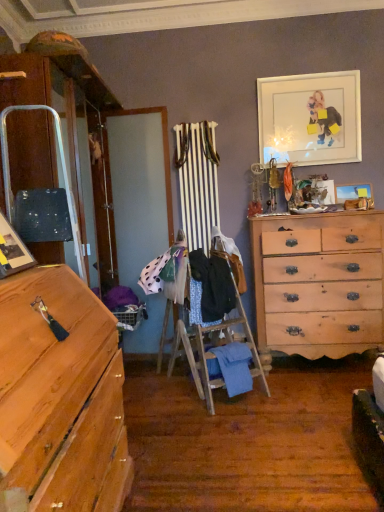
This screenshot has height=512, width=384. I want to click on light brown wooden chest of drawers at right, so click(x=319, y=283).

Measure the distance between point (346, 199) and camera.

Point (346, 199) is 11.96 feet from camera.

What do you see at coordinates (12, 251) in the screenshot? Image resolution: width=384 pixels, height=512 pixels. I see `matte black picture frame at left, marked as the 3th picture frame in a right-to-left arrangement` at bounding box center [12, 251].

From the picture: How much space does white matte picture frame at upper right, arranged as the 2th picture frame when viewed from the back, occupy horizontally?

white matte picture frame at upper right, arranged as the 2th picture frame when viewed from the back, is 3.61 inches in width.

You are a GUI agent. You are given a task and a screenshot of the screen. Output one action in this format:
    pyautogui.click(x=<x>, y=<y>)
    Task: Click on the blue textured fabric at center, which ranks as the 3th clothing in top-to-bottom order
    
    Given the screenshot: What is the action you would take?
    pyautogui.click(x=198, y=305)

Does point (350, 187) come in front of point (233, 384)?

No, (350, 187) is further to viewer.

Between wooden picture frame at upper right, which appears as the third picture frame when viewed from the front, and blue cotton blanket at center, which is the 1th clothing from bottom to top, which one has more height?

blue cotton blanket at center, which is the 1th clothing from bottom to top.

Would you say wooden picture frame at upper right, the second picture frame when ordered from top to bottom, is to the left or to the right of blue cotton blanket at center, which is the fourth clothing in top-to-bottom order, in the picture?

Based on their positions, wooden picture frame at upper right, the second picture frame when ordered from top to bottom, is located to the right of blue cotton blanket at center, which is the fourth clothing in top-to-bottom order.

The width and height of the screenshot is (384, 512). I want to click on the 3rd clothing in front of the wooden picture frame at upper right, the 1th picture frame in the back-to-front sequence, starting your count from the anchor, so click(233, 367).

Is wooden picture frame at upper right, the 1th picture frame in the back-to-front sequence, a part of light brown wooden chest of drawers at right?

No, wooden picture frame at upper right, the 1th picture frame in the back-to-front sequence, is not inside light brown wooden chest of drawers at right.

This screenshot has width=384, height=512. I want to click on picture frame that is the 2nd one when counting backward from the light brown wooden chest of drawers at right, so coord(354,193).

From the image's perspective, does light brown wooden chest of drawers at right appear lower than wooden picture frame at upper right, which appears as the third picture frame when viewed from the front?

Yes.

From a real-world perspective, is light brown wooden chest of drawers at right positioned under wooden picture frame at upper right, which is the third picture frame in left-to-right order, based on gravity?

Yes.

Is light brown wooden chest of drawers at right at the left side of dark blue fabric at center, the 2th clothing from the top?

No, light brown wooden chest of drawers at right is not to the left of dark blue fabric at center, the 2th clothing from the top.

Choose the correct answer: Is light brown wooden chest of drawers at right inside dark blue fabric at center, the third clothing in the bottom-to-top sequence, or outside it?

light brown wooden chest of drawers at right is not inside dark blue fabric at center, the third clothing in the bottom-to-top sequence, it's outside.

From a real-world perspective, relative to dark blue fabric at center, the 2th clothing from the top, is light brown wooden chest of drawers at right vertically above or below?

In terms of real-world spatial position, light brown wooden chest of drawers at right is below dark blue fabric at center, the 2th clothing from the top.

Is light brown wooden chest of drawers at right wider than dark blue fabric at center, the third clothing in the bottom-to-top sequence?

Indeed, light brown wooden chest of drawers at right has a greater width compared to dark blue fabric at center, the third clothing in the bottom-to-top sequence.

Is matte black picture frame at left, the 3th picture frame positioned from the back, to the left of dark blue fabric at center, the 2th clothing from the top, from the viewer's perspective?

Yes, matte black picture frame at left, the 3th picture frame positioned from the back, is to the left of dark blue fabric at center, the 2th clothing from the top.

Is dark blue fabric at center, the third clothing in the bottom-to-top sequence, surrounded by matte black picture frame at left, the 3th picture frame positioned from the back?

Definitely not — dark blue fabric at center, the third clothing in the bottom-to-top sequence, is not inside matte black picture frame at left, the 3th picture frame positioned from the back.

From a real-world perspective, is matte black picture frame at left, marked as the 3th picture frame in a right-to-left arrangement, positioned above or below dark blue fabric at center, the third clothing in the bottom-to-top sequence?

In terms of real-world spatial position, matte black picture frame at left, marked as the 3th picture frame in a right-to-left arrangement, is above dark blue fabric at center, the third clothing in the bottom-to-top sequence.

Which object is positioned more to the left, wooden picture frame at upper right, the 1th picture frame in the back-to-front sequence, or dark blue fabric at center, the 2th clothing from the top?

From the viewer's perspective, dark blue fabric at center, the 2th clothing from the top, appears more on the left side.

Can you confirm if wooden picture frame at upper right, the second picture frame when ordered from top to bottom, is bigger than dark blue fabric at center, the 2th clothing from the top?

No.

Is wooden picture frame at upper right, which appears as the third picture frame when viewed from the front, in front of dark blue fabric at center, the third clothing in the bottom-to-top sequence?

No, wooden picture frame at upper right, which appears as the third picture frame when viewed from the front, is further to the viewer.

From the image's perspective, is wooden picture frame at upper right, which appears as the third picture frame when viewed from the front, on top of dark blue fabric at center, the third clothing in the bottom-to-top sequence?

Correct, wooden picture frame at upper right, which appears as the third picture frame when viewed from the front, appears higher than dark blue fabric at center, the third clothing in the bottom-to-top sequence, in the image.

Find the location of `the 1st clothing above the blue textured fabric at center, which ranks as the 3th clothing in top-to-bottom order (from the image's perspective)`. the 1st clothing above the blue textured fabric at center, which ranks as the 3th clothing in top-to-bottom order (from the image's perspective) is located at coordinates point(211,287).

Which is behind, blue textured fabric at center, the 2th clothing positioned from the bottom, or dark blue fabric at center, the third clothing in the bottom-to-top sequence?

blue textured fabric at center, the 2th clothing positioned from the bottom, is further from the camera.

From a real-world perspective, who is located higher, blue textured fabric at center, the 2th clothing positioned from the bottom, or dark blue fabric at center, the third clothing in the bottom-to-top sequence?

dark blue fabric at center, the third clothing in the bottom-to-top sequence.

Considering the positions of objects matte black picture frame at left, the 3th picture frame positioned from the back, and white matte picture frame at upper right, the 2th picture frame from the left, in the image provided, who is more to the left, matte black picture frame at left, the 3th picture frame positioned from the back, or white matte picture frame at upper right, the 2th picture frame from the left,?

Positioned to the left is matte black picture frame at left, the 3th picture frame positioned from the back.

Can we say matte black picture frame at left, which ranks as the first picture frame in bottom-to-top order, lies outside white matte picture frame at upper right, which is the 2th picture frame in right-to-left order?

Yes, matte black picture frame at left, which ranks as the first picture frame in bottom-to-top order, is located beyond the bounds of white matte picture frame at upper right, which is the 2th picture frame in right-to-left order.

Consider the image. From the image's perspective, is matte black picture frame at left, the 3th picture frame positioned from the back, below white matte picture frame at upper right, positioned as the second picture frame in front-to-back order?

Yes, from the image's perspective, matte black picture frame at left, the 3th picture frame positioned from the back, is below white matte picture frame at upper right, positioned as the second picture frame in front-to-back order.

At what (x,y) coordinates should I click in order to perform the action: click on the 1st picture frame behind the matte black picture frame at left, the 3th picture frame positioned from the back. Please return your answer as a coordinate pair (x, y). The width and height of the screenshot is (384, 512). Looking at the image, I should click on (310, 118).

The height and width of the screenshot is (512, 384). Identify the location of clothing that is the 4th one when counting downward from the wooden picture frame at upper right, positioned as the 2th picture frame in bottom-to-top order (from the image's perspective). (233, 367).

This screenshot has height=512, width=384. Find the location of `chest of drawers on the left of wooden picture frame at upper right, the 1th picture frame in the back-to-front sequence`. chest of drawers on the left of wooden picture frame at upper right, the 1th picture frame in the back-to-front sequence is located at coordinates pos(319,283).

When comparing their distances from dark blue fabric at center, the third clothing in the bottom-to-top sequence, does matte black picture frame at left, which ranks as the first picture frame in bottom-to-top order, or light brown wooden chest of drawers at right seem further?

matte black picture frame at left, which ranks as the first picture frame in bottom-to-top order, is further to dark blue fabric at center, the third clothing in the bottom-to-top sequence.

When comparing their distances from light brown wooden chest of drawers at right, does polka dot fabric at center, the 1th clothing viewed from the top, or blue cotton blanket at center, which is the 1th clothing from bottom to top, seem closer?

blue cotton blanket at center, which is the 1th clothing from bottom to top.

Looking at the image, which one is located further to blue textured fabric at center, which ranks as the 3th clothing in top-to-bottom order, dark blue fabric at center, the 2th clothing from the top, or white matte picture frame at upper right, the 2th picture frame from the left?

white matte picture frame at upper right, the 2th picture frame from the left, is positioned further to the anchor blue textured fabric at center, which ranks as the 3th clothing in top-to-bottom order.

Which object lies further to the anchor point light brown wooden chest of drawers at right, matte black picture frame at left, which ranks as the first picture frame in bottom-to-top order, or white matte picture frame at upper right, which is the 2th picture frame in right-to-left order?

Based on the image, matte black picture frame at left, which ranks as the first picture frame in bottom-to-top order, appears to be further to light brown wooden chest of drawers at right.

Which object lies further to the anchor point matte black picture frame at left, the 3th picture frame positioned from the back, wooden picture frame at upper right, the 1th picture frame in the back-to-front sequence, or polka dot fabric at center, positioned as the 4th clothing in bottom-to-top order?

The object further to matte black picture frame at left, the 3th picture frame positioned from the back, is wooden picture frame at upper right, the 1th picture frame in the back-to-front sequence.

Looking at the image, which one is located closer to wooden picture frame at upper right, the 1th picture frame in the back-to-front sequence, blue textured fabric at center, which ranks as the 3th clothing in top-to-bottom order, or dark blue fabric at center, the 2th clothing from the top?

dark blue fabric at center, the 2th clothing from the top, is closer to wooden picture frame at upper right, the 1th picture frame in the back-to-front sequence.

Considering their positions, is blue textured fabric at center, which ranks as the 3th clothing in top-to-bottom order, positioned further to matte black picture frame at left, which ranks as the first picture frame in bottom-to-top order, than blue cotton blanket at center, which is the 1th clothing from bottom to top?

blue cotton blanket at center, which is the 1th clothing from bottom to top, is further to matte black picture frame at left, which ranks as the first picture frame in bottom-to-top order.

From the image, which object appears to be nearer to light brown wooden chest of drawers at right, blue textured fabric at center, which ranks as the 3th clothing in top-to-bottom order, or dark blue fabric at center, the 2th clothing from the top?

The object closer to light brown wooden chest of drawers at right is dark blue fabric at center, the 2th clothing from the top.

Locate an element on the screen. picture frame between polka dot fabric at center, positioned as the 4th clothing in bottom-to-top order, and wooden picture frame at upper right, the 1th picture frame in the back-to-front sequence is located at coordinates (310, 118).

The image size is (384, 512). Find the location of `clothing located between matte black picture frame at left, which ranks as the first picture frame in bottom-to-top order, and blue cotton blanket at center, which is the 1th clothing from bottom to top, in the depth direction`. clothing located between matte black picture frame at left, which ranks as the first picture frame in bottom-to-top order, and blue cotton blanket at center, which is the 1th clothing from bottom to top, in the depth direction is located at coordinates (211, 287).

This screenshot has width=384, height=512. I want to click on chest of drawers between white matte picture frame at upper right, the 2th picture frame from the left, and blue textured fabric at center, the 2th clothing positioned from the bottom, in the up-down direction, so click(x=319, y=283).

Identify the location of the chest of drawers between white matte picture frame at upper right, which is the 2th picture frame in right-to-left order, and blue cotton blanket at center, which is the fourth clothing in top-to-bottom order, vertically. (319, 283).